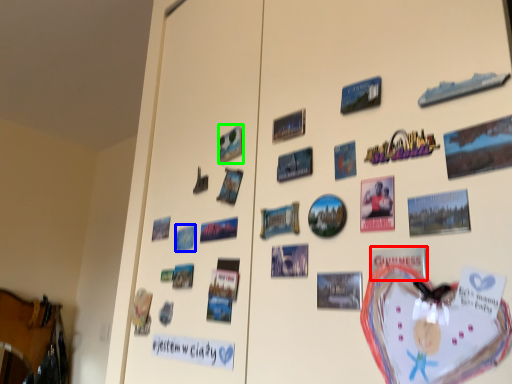
Question: Which is nearer to the postcard (highlighted by a red box)? postcard (highlighted by a blue box) or postcard (highlighted by a green box).

Choices:
 (A) postcard
 (B) postcard

Answer: (B)